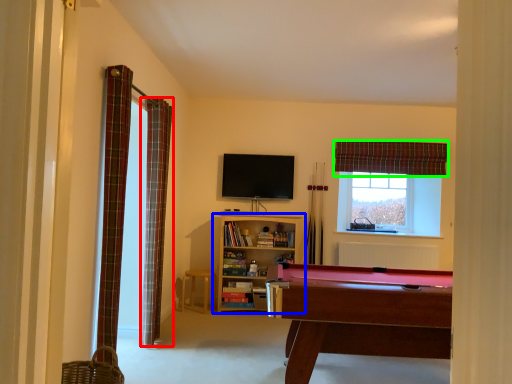
Question: Based on their relative distances, which object is nearer to curtain (highlighted by a red box)? Choose from shelf (highlighted by a blue box) and curtain (highlighted by a green box).

Choices:
 (A) shelf
 (B) curtain

Answer: (A)